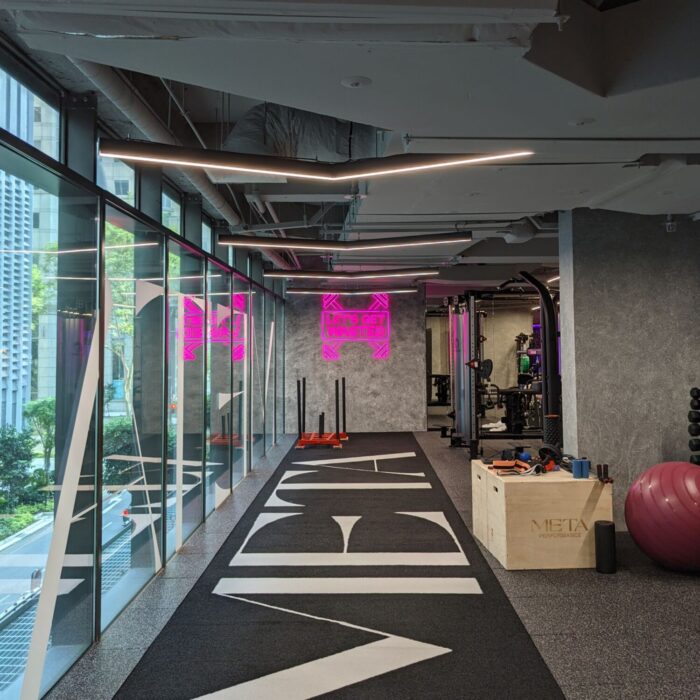
I want to click on exercise ball, red, so click(x=677, y=514).